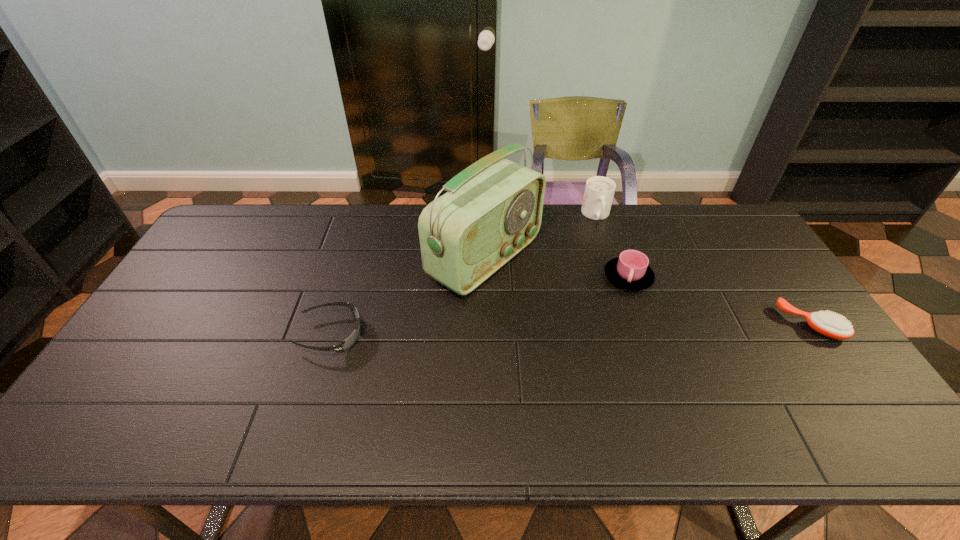
Find the location of a particular element. The width and height of the screenshot is (960, 540). free space located on the front panel of the second object from left to right is located at coordinates (597, 323).

At what (x,y) coordinates should I click in order to perform the action: click on free space located 0.280m on the side with the handle of the third tallest object. Please return your answer as a coordinate pair (x, y). Looking at the image, I should click on (654, 375).

At what (x,y) coordinates should I click in order to perform the action: click on vacant space located 0.070m on the side with the handle of the third tallest object. Please return your answer as a coordinate pair (x, y). The width and height of the screenshot is (960, 540). Looking at the image, I should click on (637, 313).

This screenshot has height=540, width=960. Identify the location of free space located on the side with the handle of the third tallest object. (645, 343).

You are a GUI agent. You are given a task and a screenshot of the screen. Output one action in this format:
    pyautogui.click(x=<x>, y=<y>)
    Task: Click on the free space located on the side with the handle of the cappuccino
    Image resolution: width=960 pixels, height=540 pixels.
    Given the screenshot: What is the action you would take?
    pyautogui.click(x=603, y=241)

Find the location of a particular element. Image resolution: width=960 pixels, height=540 pixels. vacant space positioned 0.300m on the side with the handle of the cappuccino is located at coordinates (614, 290).

Locate an element on the screen. The image size is (960, 540). vacant area situated 0.380m on the side with the handle of the cappuccino is located at coordinates (619, 310).

The height and width of the screenshot is (540, 960). In order to click on radio receiver that is at the far edge in this screenshot , I will do [492, 210].

I want to click on cappuccino that is at the far edge, so click(x=599, y=191).

Where is `object at the right edge`? This screenshot has width=960, height=540. object at the right edge is located at coordinates (829, 324).